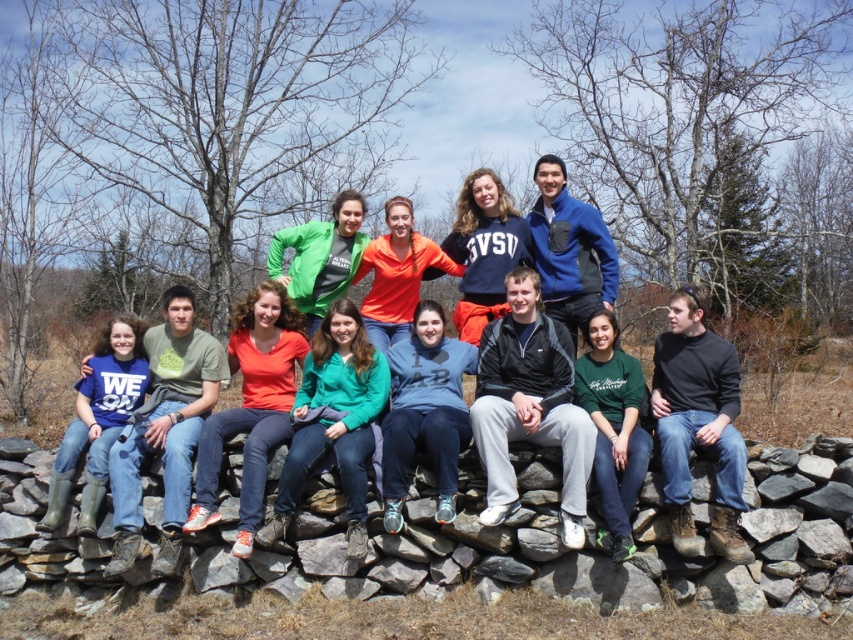
You are a photographer trying to capture a clear shot of the gray stone at center and the blue fleece sweatshirt at center. Since you want both subjects to be in focus, you need to know their relative positions. Which object is positioned lower in the image?

The gray stone at center is located below the blue fleece sweatshirt at center, so the gray stone at center is positioned lower in the image.

You are standing at the center of the stone wall where the group is posing. You want to place a small flag exactly at the gray stone marked by point (563,545). Can you confirm the location of this point relative to the group?

The point (563,545) marks the gray stone at center, so placing the flag there would position it directly at the central gray stone where the group is gathered.

You are organizing a photo shoot and need to ensure that all participants are visible in the frame. You notice two sweatshirts in the center of the image, a blue fleece sweatshirt at center and a green matte sweatshirt at center. Which one has a larger width and might block the view of others if positioned incorrectly?

The blue fleece sweatshirt at center has a larger width than the green matte sweatshirt at center, so it might block the view of others if positioned incorrectly.